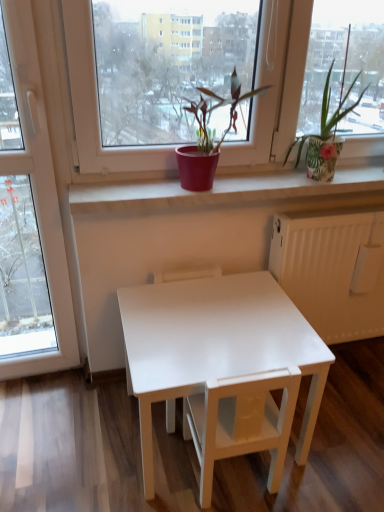
Question: Based on their positions, is white matte chair at center, which appears as the 2th armchair when viewed from the back, located to the left or right of white glossy table at center?

Choices:
 (A) right
 (B) left

Answer: (A)

Question: In terms of height, does white matte chair at center, positioned as the 1th armchair in front-to-back order, look taller or shorter compared to white glossy table at center?

Choices:
 (A) short
 (B) tall

Answer: (A)

Question: Which is nearer to the white matte chair at center, positioned as the 1th armchair in front-to-back order?

Choices:
 (A) matte red pot at center, acting as the second houseplant starting from the right
 (B) white glossy table at center
 (C) white glossy table at center, the first armchair viewed from the back
 (D) green leafy plant at upper right, the first houseplant positioned from the right

Answer: (B)

Question: Estimate the real-world distances between objects in this image. Which object is farther from the matte red pot at center, acting as the second houseplant starting from the right?

Choices:
 (A) white matte chair at center, which appears as the 2th armchair when viewed from the back
 (B) white glossy table at center, the 2th armchair from the front
 (C) white glossy table at center
 (D) green leafy plant at upper right, the first houseplant positioned from the right

Answer: (A)